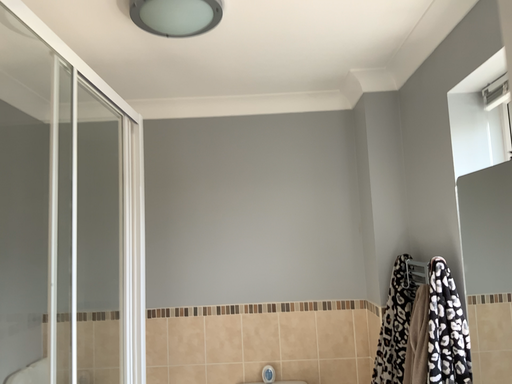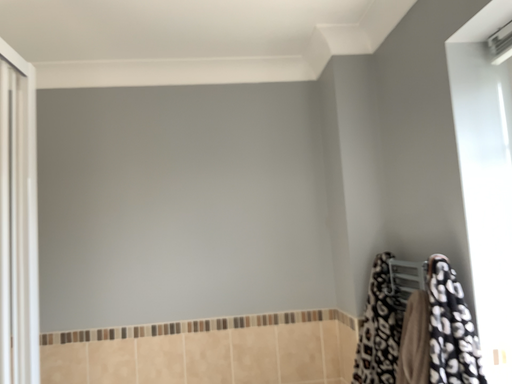
Question: Which way did the camera rotate in the video?

Choices:
 (A) rotated right
 (B) rotated left

Answer: (A)